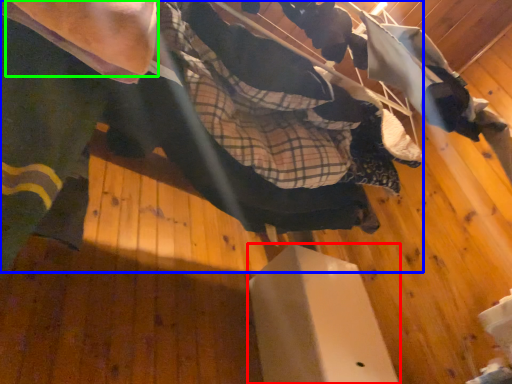
Question: Which object is the farthest from furniture (highlighted by a red box)? Choose among these: skateboarder (highlighted by a blue box) or arm (highlighted by a green box).

Choices:
 (A) skateboarder
 (B) arm

Answer: (B)